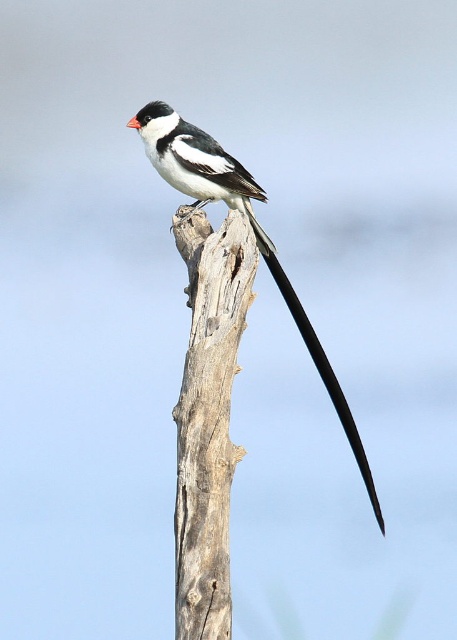
Which is more to the left, gray rough wood at center or white glossy bird at center?

gray rough wood at center

Is point (228, 616) positioned before point (189, 150)?

Yes, point (228, 616) is in front of point (189, 150).

At what (x,y) coordinates should I click in order to perform the action: click on gray rough wood at center. Please return your answer as a coordinate pair (x, y). Image resolution: width=457 pixels, height=640 pixels. Looking at the image, I should click on (207, 419).

Can you confirm if white glossy bird at center is positioned to the right of black glossy tail at upper center?

No, white glossy bird at center is not to the right of black glossy tail at upper center.

Who is positioned more to the left, white glossy bird at center or black glossy tail at upper center?

From the viewer's perspective, white glossy bird at center appears more on the left side.

Does point (164, 120) come closer to viewer compared to point (262, 252)?

Yes, it is in front of point (262, 252).

Identify the location of white glossy bird at center. (249, 224).

Between gray rough wood at center and black glossy tail at upper center, which one is positioned higher?

black glossy tail at upper center is higher up.

Is gray rough wood at center taller than black glossy tail at upper center?

Correct, gray rough wood at center is much taller as black glossy tail at upper center.

Which is in front, point (185, 232) or point (366, 474)?

Positioned in front is point (185, 232).

You are a GUI agent. You are given a task and a screenshot of the screen. Output one action in this format:
    pyautogui.click(x=<x>, y=<y>)
    Task: Click on the gray rough wood at center
    The height and width of the screenshot is (640, 457).
    Given the screenshot: What is the action you would take?
    pyautogui.click(x=207, y=419)